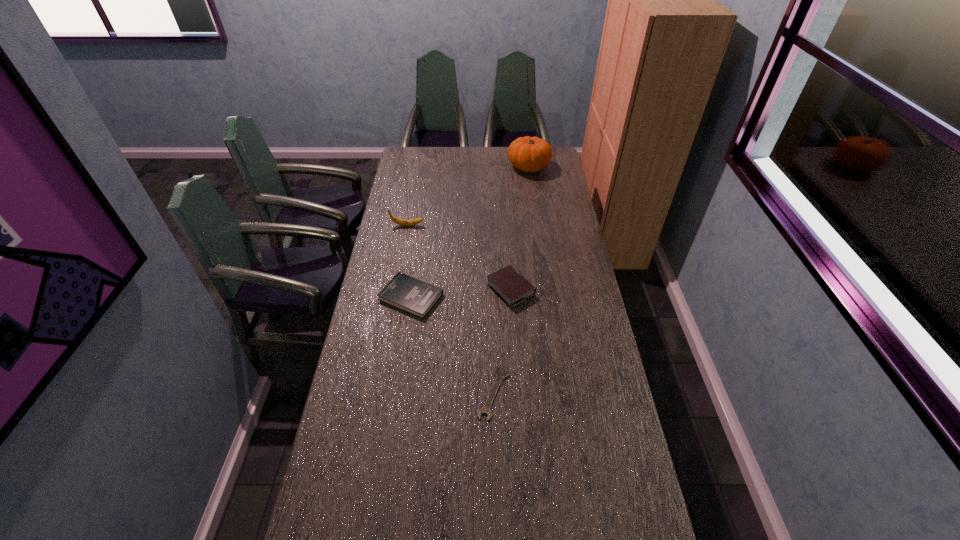
Choose which object is the fourth nearest neighbor to the book. Please provide its 2D coordinates. Your answer should be formatted as a tuple, i.e. [(x, y)], where the tuple contains the x and y coordinates of a point satisfying the conditions above.

[(530, 154)]

Where is `the fourth closest object to the book`? This screenshot has width=960, height=540. the fourth closest object to the book is located at coordinates (530, 154).

Locate an element on the screen. The width and height of the screenshot is (960, 540). vacant space that satisfies the following two spatial constraints: 1. on the peel of the fourth shortest object from the top; 2. on the right side of the book is located at coordinates (395, 297).

The image size is (960, 540). Find the location of `vacant area that satisfies the following two spatial constraints: 1. on the peel of the fourth tallest object from the top; 2. on the left side of the banana`. vacant area that satisfies the following two spatial constraints: 1. on the peel of the fourth tallest object from the top; 2. on the left side of the banana is located at coordinates (395, 297).

You are a GUI agent. You are given a task and a screenshot of the screen. Output one action in this format:
    pyautogui.click(x=<x>, y=<y>)
    Task: Click on the vacant region that satisfies the following two spatial constraints: 1. on the peel of the second farthest object from the top; 2. on the right side of the book
    Image resolution: width=960 pixels, height=540 pixels.
    Given the screenshot: What is the action you would take?
    pyautogui.click(x=395, y=297)

The image size is (960, 540). In order to click on free region that satisfies the following two spatial constraints: 1. on the back side of the pumpkin; 2. on the right side of the second shortest object in this screenshot , I will do `click(430, 166)`.

The width and height of the screenshot is (960, 540). What are the coordinates of `blank space that satisfies the following two spatial constraints: 1. on the peel of the banana from the top; 2. on the back side of the nearest object` in the screenshot? It's located at (376, 393).

You are a GUI agent. You are given a task and a screenshot of the screen. Output one action in this format:
    pyautogui.click(x=<x>, y=<y>)
    Task: Click on the blank space that satisfies the following two spatial constraints: 1. on the peel of the shortest object from the top; 2. on the right side of the fourth nearest object
    This screenshot has height=540, width=960.
    Given the screenshot: What is the action you would take?
    click(x=376, y=393)